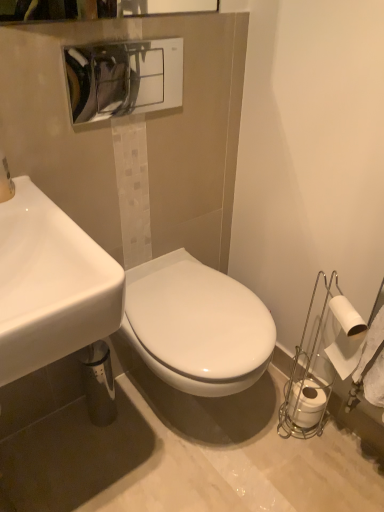
Find the location of a particular element. Image resolution: width=384 pixels, height=512 pixels. empty space that is to the right of white matte toilet paper at lower right, which is counted as the 2th toilet paper, starting from the top is located at coordinates (345, 438).